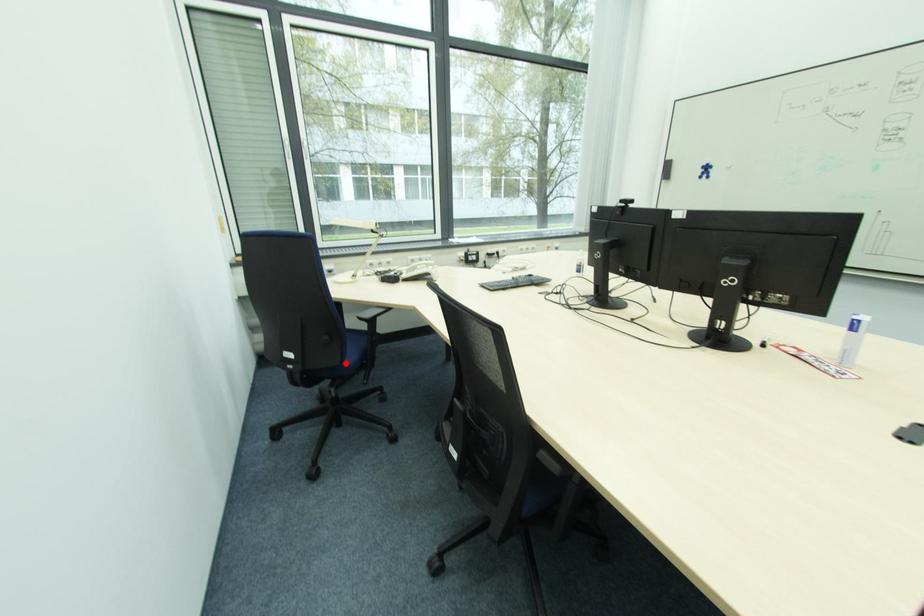
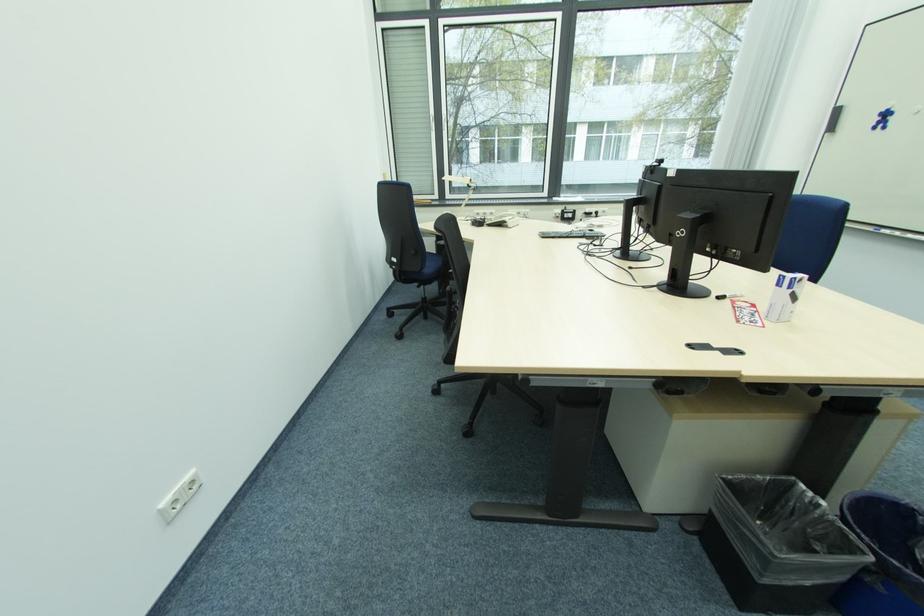
Question: I am providing you with two images of the same scene from different viewpoints. Given a red point in image1, look at the same physical point in image2. Is it:

Choices:
 (A) Closer to the viewpoint
 (B) Farther from the viewpoint

Answer: (A)